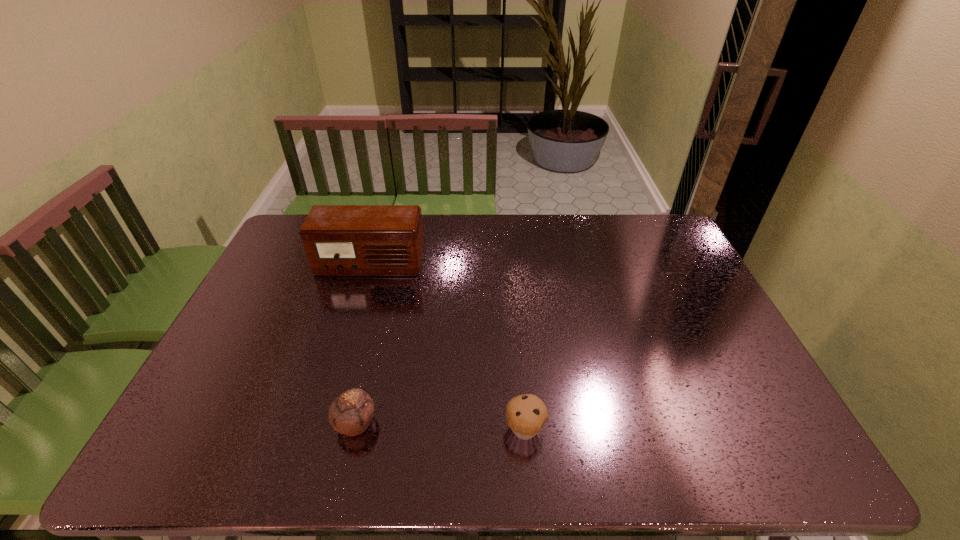
The image size is (960, 540). Identify the location of radio receiver. (338, 239).

At what (x,y) coordinates should I click in order to perform the action: click on the tallest object. Please return your answer as a coordinate pair (x, y). This screenshot has width=960, height=540. Looking at the image, I should click on (338, 239).

You are a GUI agent. You are given a task and a screenshot of the screen. Output one action in this format:
    pyautogui.click(x=<x>, y=<y>)
    Task: Click on the left muffin
    Image resolution: width=960 pixels, height=540 pixels.
    Given the screenshot: What is the action you would take?
    pyautogui.click(x=350, y=413)

Locate an element on the screen. The width and height of the screenshot is (960, 540). the rightmost object is located at coordinates (526, 414).

Identify the location of vacant space located 0.120m on the front-facing side of the farthest object. click(x=357, y=306).

Identify the location of vacant point located on the back of the left muffin. The height and width of the screenshot is (540, 960). (386, 293).

Where is `blank space located on the right of the right muffin`? Image resolution: width=960 pixels, height=540 pixels. blank space located on the right of the right muffin is located at coordinates (656, 429).

Where is `object that is at the far edge`? This screenshot has height=540, width=960. object that is at the far edge is located at coordinates (338, 239).

This screenshot has width=960, height=540. In order to click on vacant space at the far edge of the desktop in this screenshot , I will do `click(522, 235)`.

In the image, there is a desktop. Where is `free space at the near edge`? free space at the near edge is located at coordinates (680, 457).